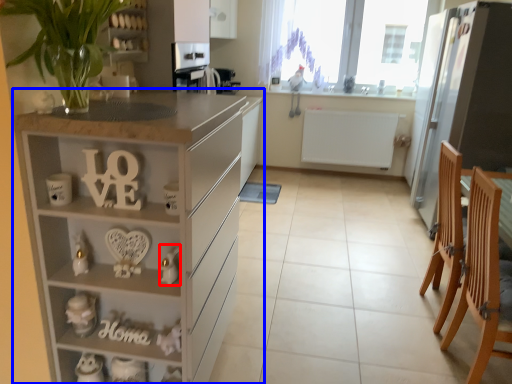
Question: Which of the following is the farthest to the observer, toy (highlighted by a red box) or cabinetry (highlighted by a blue box)?

Choices:
 (A) toy
 (B) cabinetry

Answer: (A)